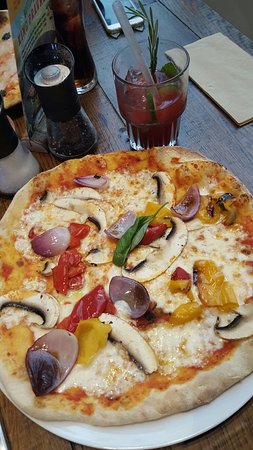
You are a GUI agent. You are given a task and a screenshot of the screen. Output one action in this format:
    pyautogui.click(x=<x>, y=<y>)
    Task: Click on the plate
    The width and height of the screenshot is (253, 450).
    Given the screenshot: What is the action you would take?
    pyautogui.click(x=173, y=431)